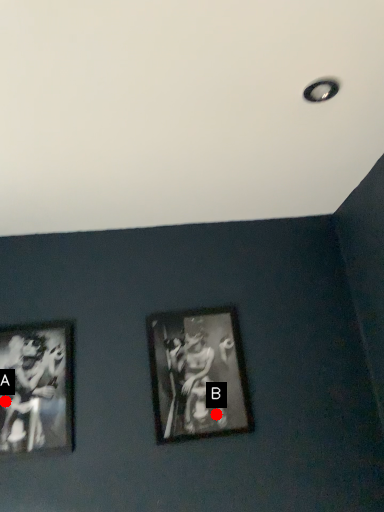
Question: Two points are circled on the image, labeled by A and B beside each circle. Which point is closer to the camera taking this photo?

Choices:
 (A) A is closer
 (B) B is closer

Answer: (A)